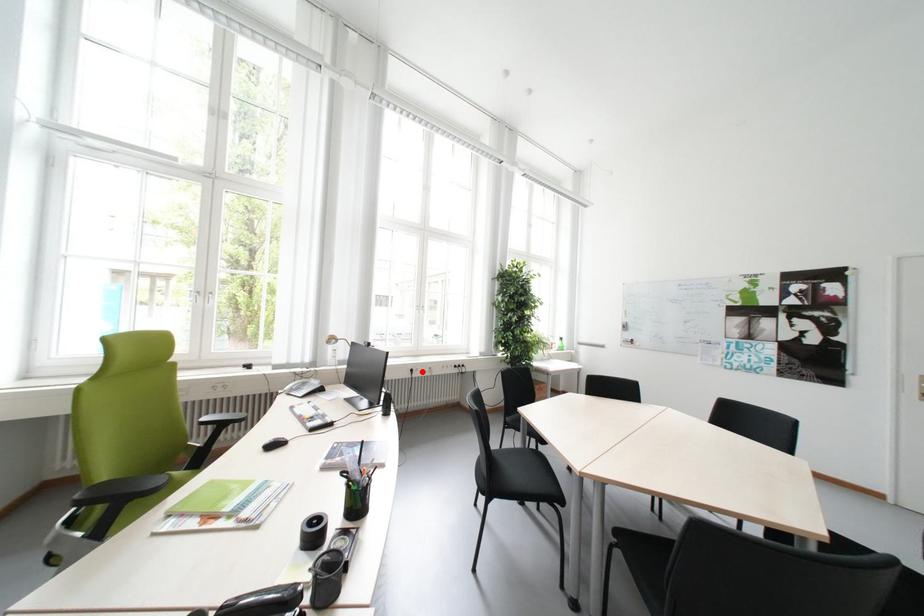
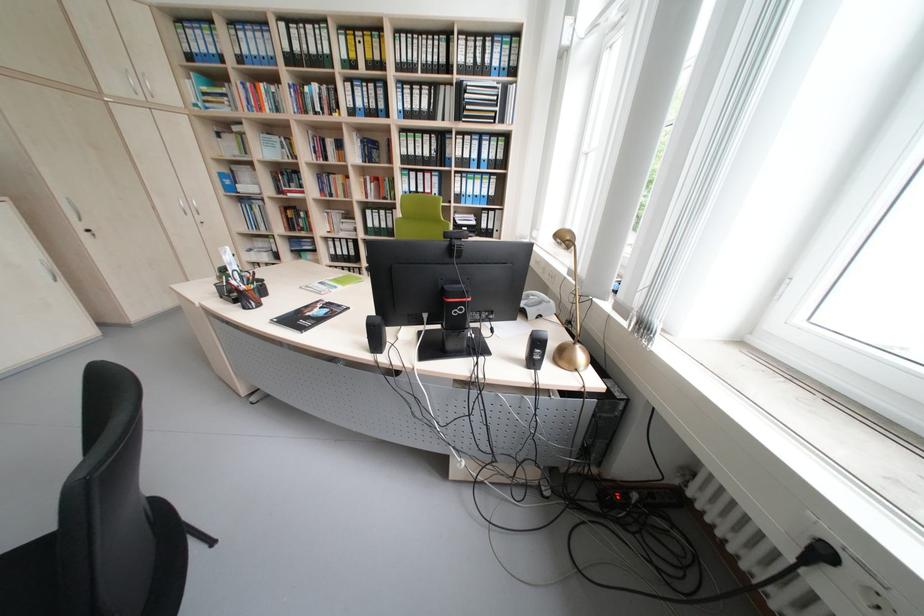
Find the pixel in the second image that matches the highlighted location in the first image.

(833, 554)